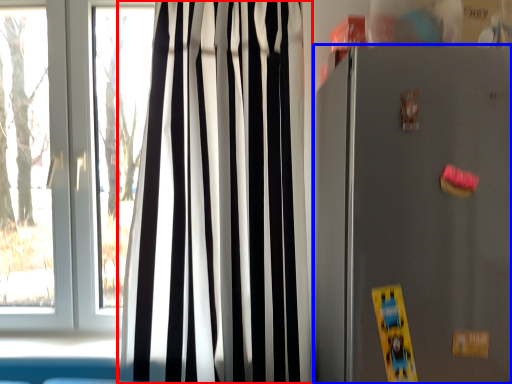
Question: Which of the following is the farthest to the observer, curtain (highlighted by a red box) or appliance (highlighted by a blue box)?

Choices:
 (A) curtain
 (B) appliance

Answer: (A)